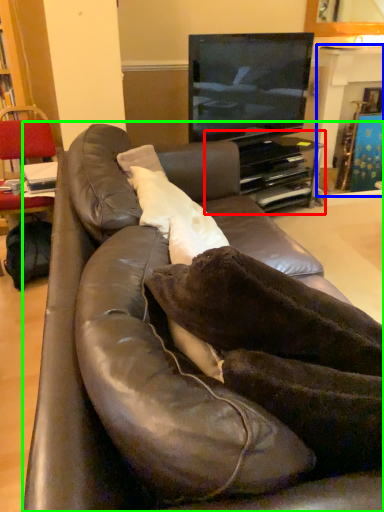
Question: Which is nearer to the entertainment center (highlighted by a red box)? fireplace (highlighted by a blue box) or studio couch (highlighted by a green box).

Choices:
 (A) fireplace
 (B) studio couch

Answer: (A)